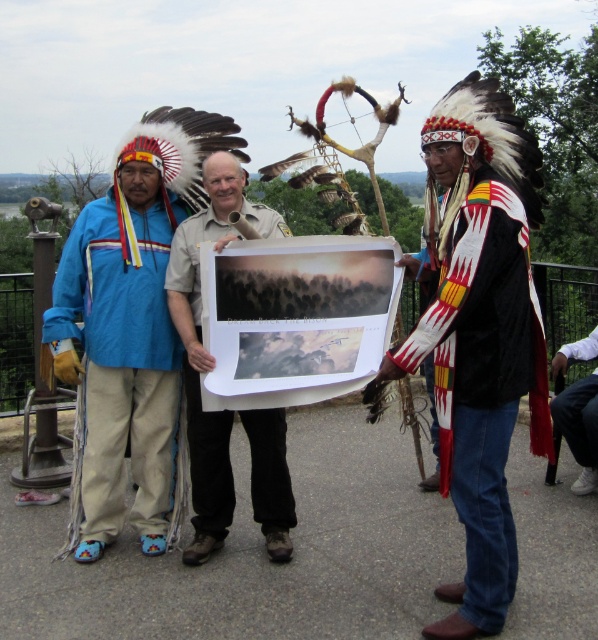
You are a photographer trying to capture a photo of the two people wearing the velvet black jacket at right and the white cotton shirt at lower right. From the photographer position, which one is on the left side?

The velvet black jacket at right is positioned to the left of the white cotton shirt at lower right, so the velvet black jacket at right is on the left side from the photographer position.

You are a photographer trying to capture a clear shot of both the velvet black jacket at right and the white cotton shirt at lower right. Which object should you focus on first to ensure both are in frame?

The velvet black jacket at right is larger than the white cotton shirt at lower right, so focus on the velvet black jacket at right first to ensure both fit in the frame.

You are a photographer trying to capture a group photo of the velvet black jacket at right and the white cotton shirt at lower right. The camera you have can only focus on subjects within a 1.5 meter range. Will both subjects be in focus?

The velvet black jacket at right and white cotton shirt at lower right are 1.44 meters apart, which is within the camera focus range of 1.5 meters. Both subjects will be in focus.